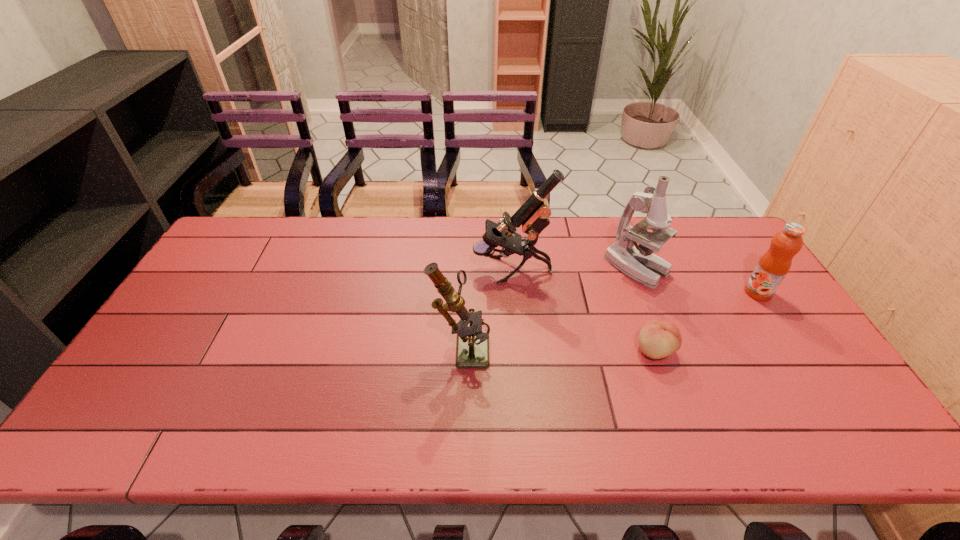
Identify the location of the rightmost microscope. This screenshot has width=960, height=540. (638, 262).

Find the location of a particular element. the nearest microscope is located at coordinates (472, 349).

At what (x,y) coordinates should I click in order to perform the action: click on fruit juice. Please return your answer as a coordinate pair (x, y). This screenshot has height=540, width=960. Looking at the image, I should click on (773, 266).

You are a GUI agent. You are given a task and a screenshot of the screen. Output one action in this format:
    pyautogui.click(x=<x>, y=<y>)
    Task: Click on the fourth tallest object
    The height and width of the screenshot is (540, 960).
    Given the screenshot: What is the action you would take?
    pyautogui.click(x=773, y=266)

Find the location of `the shortest object`. the shortest object is located at coordinates (659, 338).

Locate an element on the screen. This screenshot has height=540, width=960. blank space located on the left of the rightmost microscope is located at coordinates (516, 268).

You are a GUI agent. You are given a task and a screenshot of the screen. Output one action in this format:
    pyautogui.click(x=<x>, y=<y>)
    Task: Click on the vacant space located 0.370m at the eyepiece of the nearest microscope
    
    Given the screenshot: What is the action you would take?
    pyautogui.click(x=628, y=346)

At what (x,y) coordinates should I click in order to perform the action: click on vacant region located 0.050m on the front label of the rightmost object. Please return your answer as a coordinate pair (x, y). Looking at the image, I should click on (729, 293).

Where is `free spot located 0.070m on the front label of the rightmost object`? The width and height of the screenshot is (960, 540). free spot located 0.070m on the front label of the rightmost object is located at coordinates (722, 293).

Where is `blank area located 0.400m on the front label of the rightmost object`? This screenshot has height=540, width=960. blank area located 0.400m on the front label of the rightmost object is located at coordinates (612, 293).